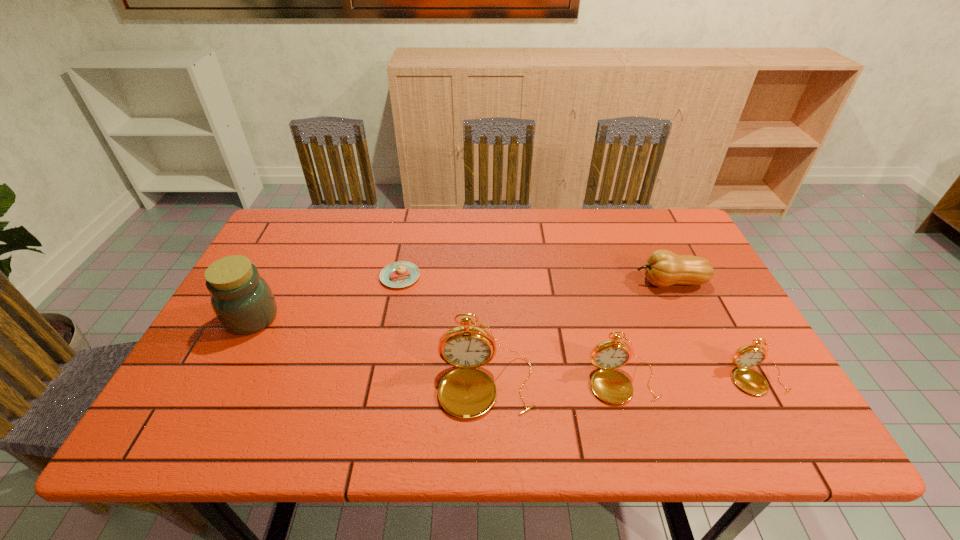
The width and height of the screenshot is (960, 540). Identify the location of the leftmost pocket watch. (467, 392).

Where is `the fourth object from right to left`? The height and width of the screenshot is (540, 960). the fourth object from right to left is located at coordinates coord(467,392).

Identify the location of the fourth object from left to right. (611, 386).

Where is `the second pocket watch from right to left`? The height and width of the screenshot is (540, 960). the second pocket watch from right to left is located at coordinates (611, 386).

Find the location of a particular element. Image resolution: width=960 pixels, height=540 pixels. the rightmost pocket watch is located at coordinates (749, 380).

Locate an element on the screen. the fifth object from right to left is located at coordinates (400, 274).

The width and height of the screenshot is (960, 540). Find the location of `the shortest object`. the shortest object is located at coordinates (400, 274).

Locate an element on the screen. The image size is (960, 540). gourd is located at coordinates click(x=663, y=268).

At what (x,y) coordinates should I click in order to perform the action: click on the third farthest object. Please return your answer as a coordinate pair (x, y). Looking at the image, I should click on (242, 300).

At what (x,y) coordinates should I click in order to perform the action: click on jar. Please return your answer as a coordinate pair (x, y). Looking at the image, I should click on (x=242, y=300).